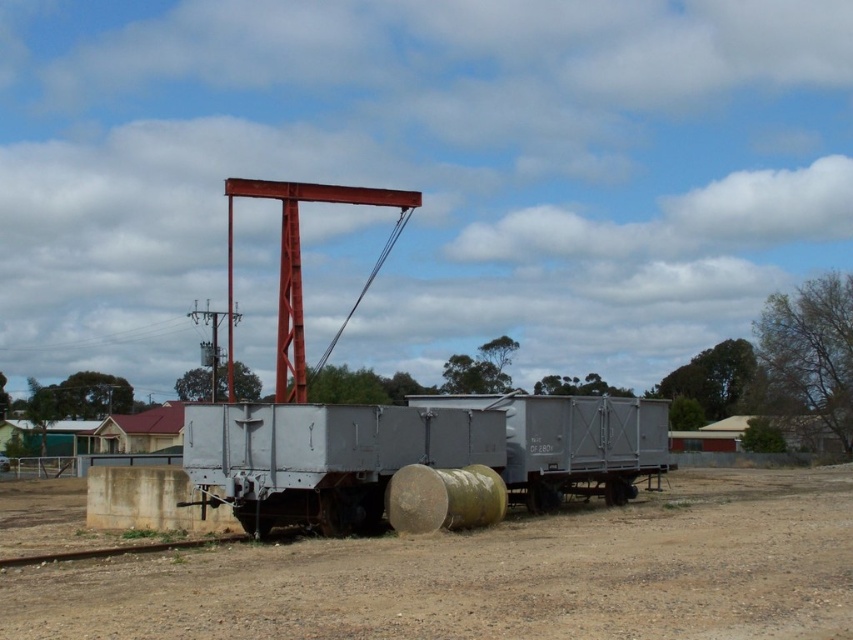
Does dull brown dirt at center appear on the right side of metallic gray train car at center?

Yes, dull brown dirt at center is to the right of metallic gray train car at center.

Is dull brown dirt at center above metallic gray train car at center?

Actually, dull brown dirt at center is below metallic gray train car at center.

Find the location of a particular element. dull brown dirt at center is located at coordinates (492, 576).